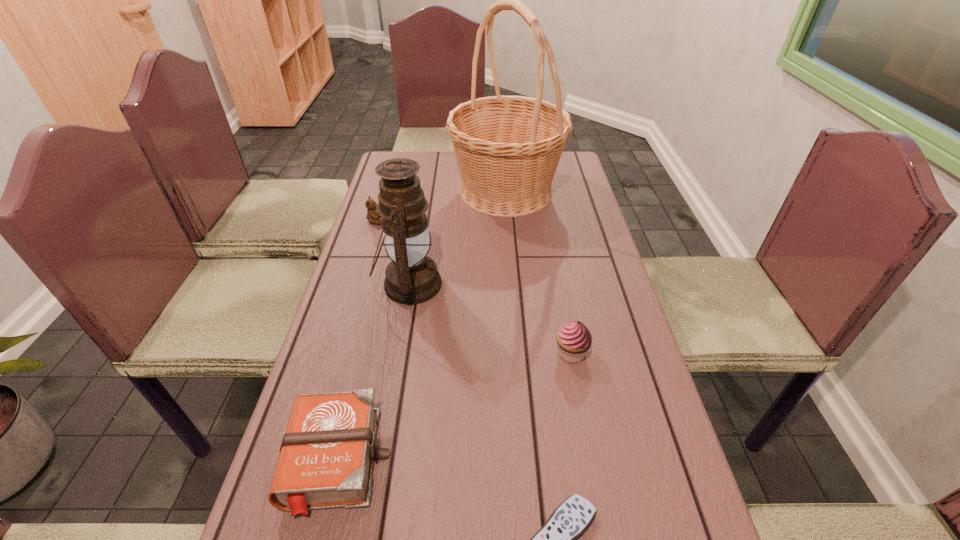
This screenshot has height=540, width=960. I want to click on vacant space located on the front-facing side of the teddy bear, so click(469, 220).

The height and width of the screenshot is (540, 960). What are the coordinates of `free space located 0.400m on the right of the Bible` in the screenshot? It's located at (603, 460).

Where is `object located in the far edge section of the desktop`? Image resolution: width=960 pixels, height=540 pixels. object located in the far edge section of the desktop is located at coordinates (508, 148).

You are a GUI agent. You are given a task and a screenshot of the screen. Output one action in this format:
    pyautogui.click(x=<x>, y=<y>)
    Task: Click on the oil lamp at the left edge
    
    Given the screenshot: What is the action you would take?
    pyautogui.click(x=411, y=278)

Where is `teddy bear that is at the left edge`? teddy bear that is at the left edge is located at coordinates (372, 215).

The height and width of the screenshot is (540, 960). Find the location of `Bible situated at the left edge`. Bible situated at the left edge is located at coordinates (326, 457).

I want to click on basket at the right edge, so click(508, 148).

Find the location of a particular element. Image resolution: width=960 pixels, height=540 pixels. cupcake that is positioned at the right edge is located at coordinates (574, 339).

This screenshot has height=540, width=960. In order to click on object at the far right corner in this screenshot , I will do `click(508, 148)`.

The width and height of the screenshot is (960, 540). In the image, there is a desktop. In order to click on vacant space at the far edge in this screenshot , I will do `click(441, 172)`.